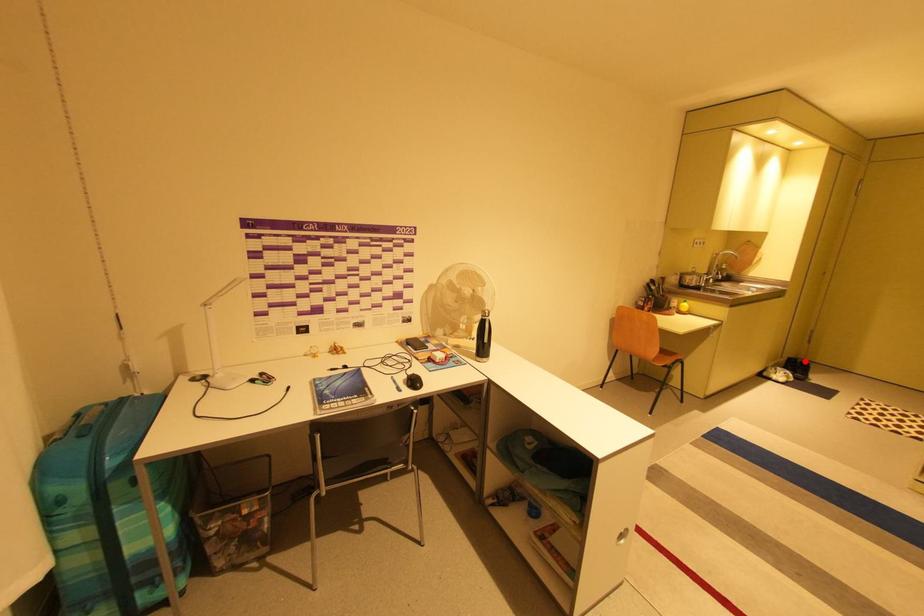
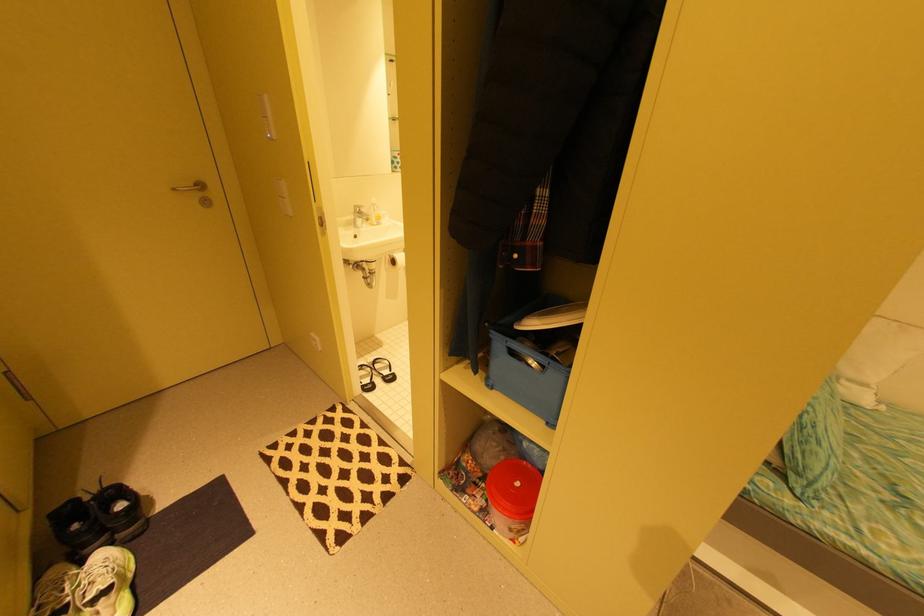
The point at the highlighted location is marked in the first image. Where is the corresponding point in the second image?

(93, 499)